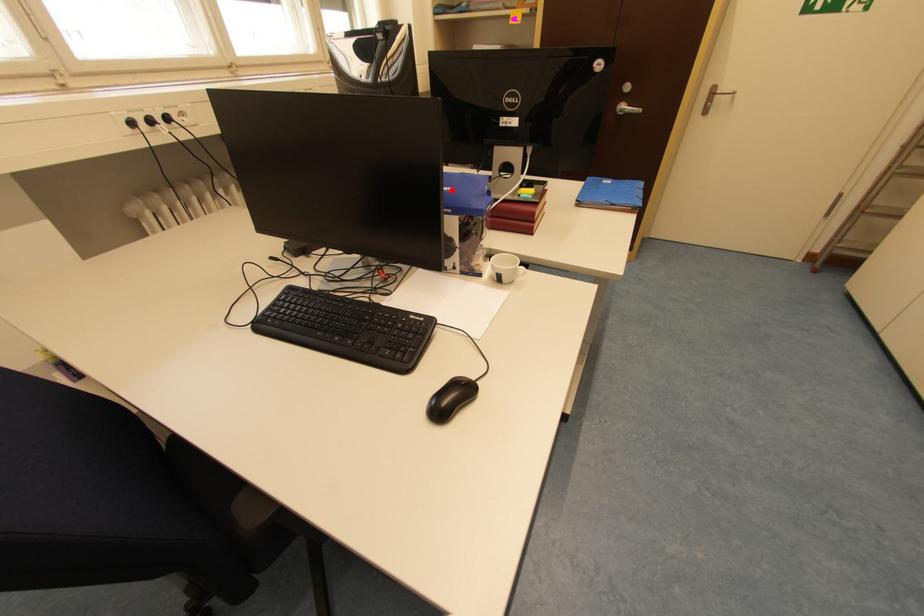
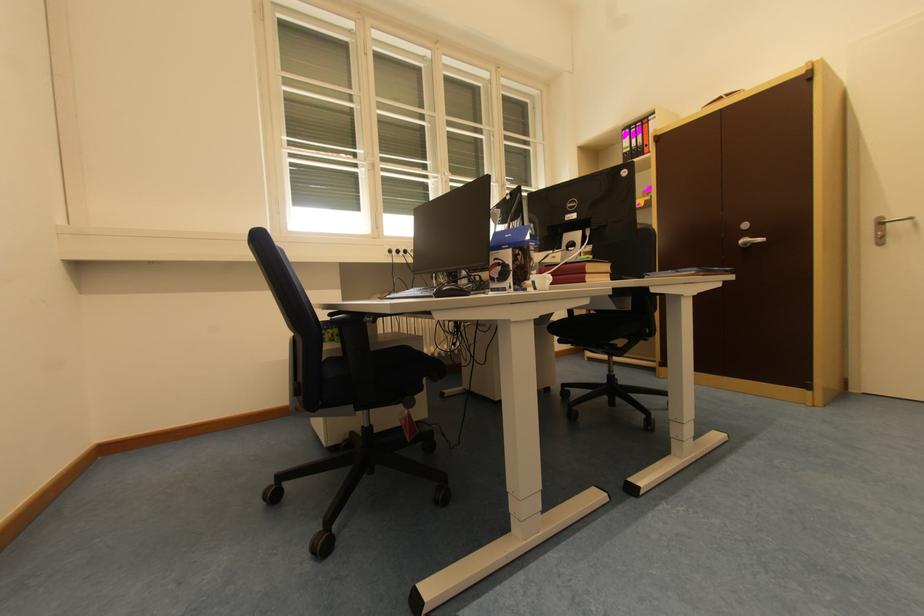
The point at the highlighted location is marked in the first image. Where is the corresponding point in the second image?

(514, 238)